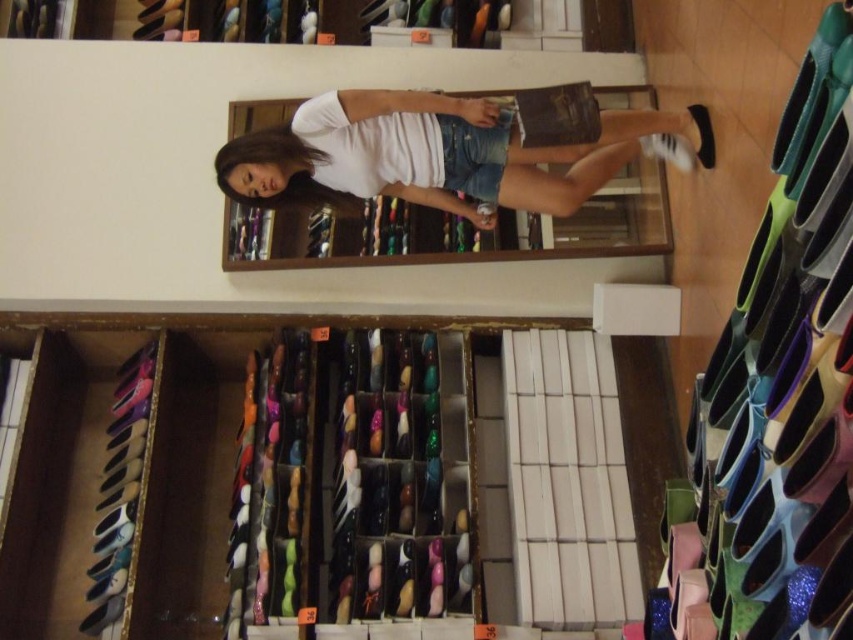
Is white matte shirt at upper center wider than black matte shoe at upper right?

Correct, the width of white matte shirt at upper center exceeds that of black matte shoe at upper right.

Is point (426, 106) in front of point (708, 128)?

That is True.

The height and width of the screenshot is (640, 853). Find the location of `white matte shirt at upper center`. white matte shirt at upper center is located at coordinates (427, 154).

Does point (364, 456) lie in front of point (560, 145)?

No, (364, 456) is behind (560, 145).

Identify the location of wooden shoe rack at lower center. (393, 492).

Image resolution: width=853 pixels, height=640 pixels. In order to click on wooden shoe rack at lower center in this screenshot , I will do `click(393, 492)`.

Based on the photo, is white matte shirt at upper center positioned at the back of white matte sneaker at center?

No, white matte shirt at upper center is closer to the viewer.

Which is behind, point (434, 182) or point (670, 150)?

The point (670, 150) is behind.

You are a GUI agent. You are given a task and a screenshot of the screen. Output one action in this format:
    pyautogui.click(x=<x>, y=<y>)
    Task: Click on the white matte shirt at upper center
    This screenshot has height=640, width=853.
    Given the screenshot: What is the action you would take?
    pyautogui.click(x=427, y=154)